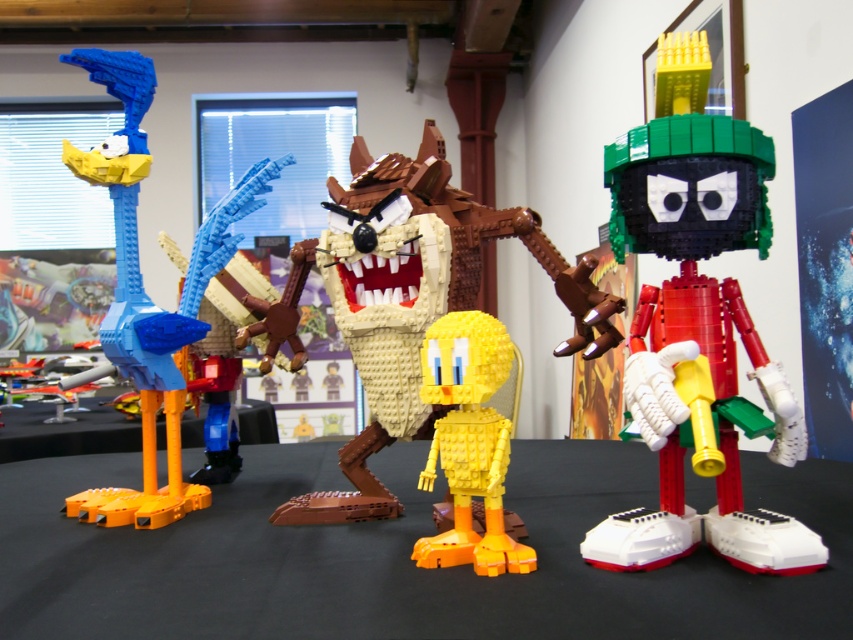
Does brown matte/tile-like wolf at center have a lesser width compared to orange matte table at lower left?

Indeed, brown matte/tile-like wolf at center has a lesser width compared to orange matte table at lower left.

Is point (392, 428) positioned in front of point (160, 438)?

Yes, it is in front of point (160, 438).

This screenshot has width=853, height=640. I want to click on brown matte/tile-like wolf at center, so click(x=416, y=301).

Is brick red lego figure at right positioned at the back of matte blue plastic duck at left?

No, brick red lego figure at right is closer to the viewer.

Which of these two, brick red lego figure at right or matte blue plastic duck at left, stands shorter?

brick red lego figure at right is shorter.

Find the location of a particular element. The height and width of the screenshot is (640, 853). brick red lego figure at right is located at coordinates (697, 330).

Who is positioned more to the left, brown matte/tile-like wolf at center or yellow matte tweety bird at center?

brown matte/tile-like wolf at center

Between brown matte/tile-like wolf at center and yellow matte tweety bird at center, which one has less height?

yellow matte tweety bird at center

Where is `brown matte/tile-like wolf at center`? brown matte/tile-like wolf at center is located at coordinates (416, 301).